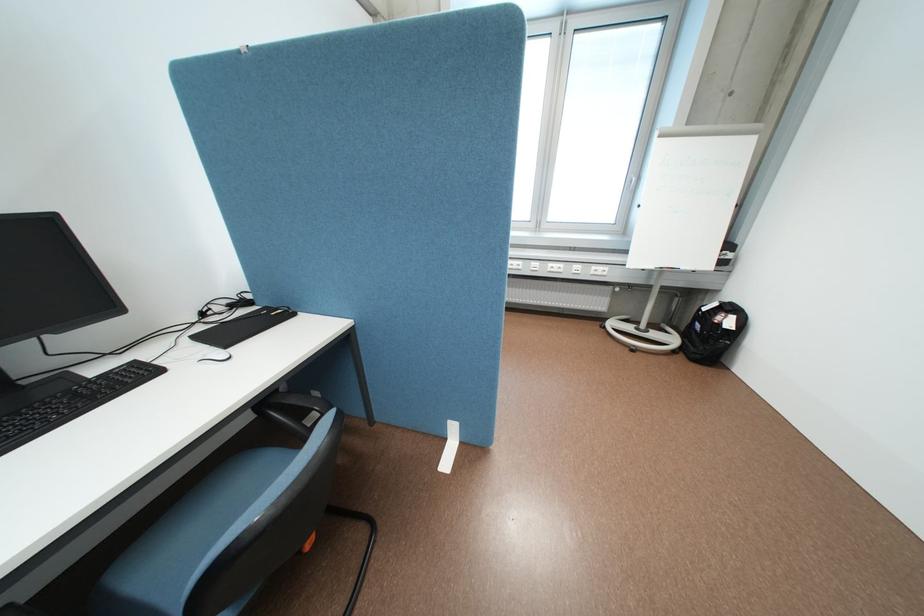
Which object does [64,400] point to?

It corresponds to the black keyboard in the image.